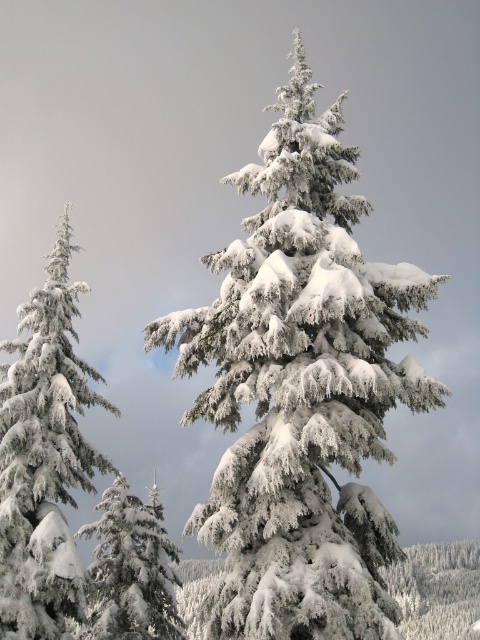
You are standing in the winter landscape and see a point marked at coordinates (45, 456). Which object from the scene does this point belong to?

The point at coordinates (45, 456) belongs to the white frosty pine at left as stated in the objects description.

From the picture: You are standing in the winter landscape and want to take a photo of both the white frosty pine at left and the white frosty pine at lower left. Which pine should you focus on first to ensure both are in the frame?

You should focus on the white frosty pine at left first because it is in front of the white frosty pine at lower left, so adjusting the camera to include both would require ensuring the foreground pine is centered while the background pine remains visible.

You are an observer standing in the winter landscape. You notice two white frosty pines. Which one is closer to you, the white frosty pine at left or the white frosty pine at lower left?

The white frosty pine at lower left is closer because it is larger than the white frosty pine at left, which is smaller.